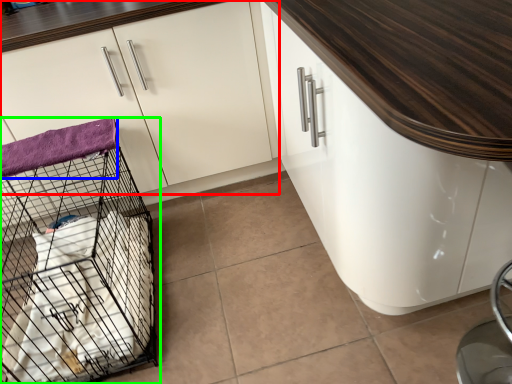
Question: Which object is the farthest from cabinetry (highlighted by a red box)? Choose among these: blanket (highlighted by a blue box) or bird cage (highlighted by a green box).

Choices:
 (A) blanket
 (B) bird cage

Answer: (B)